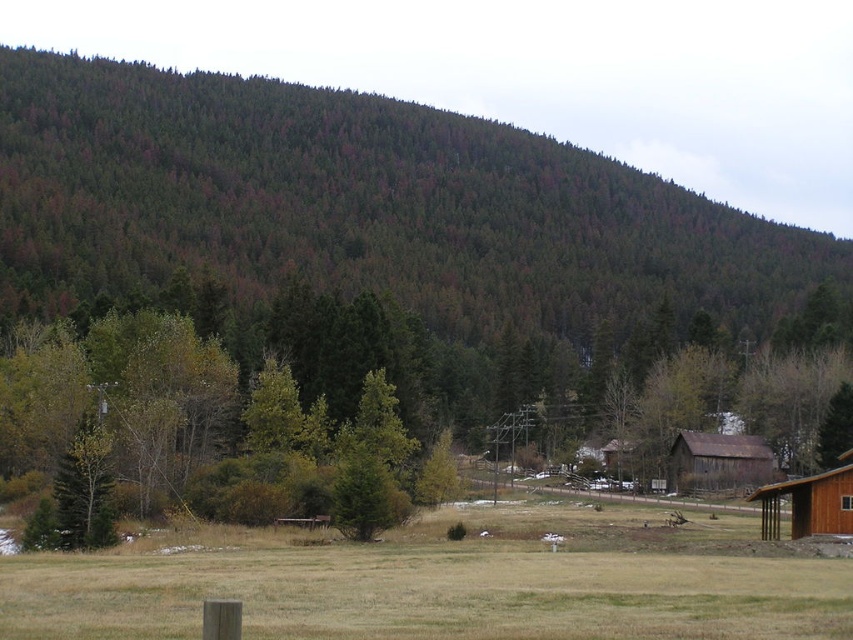
Question: Can you confirm if green forested hillside at upper center is positioned to the left of rustic wood barn at center-right?

Choices:
 (A) yes
 (B) no

Answer: (A)

Question: Which of the following is the farthest from the observer?

Choices:
 (A) brown wooden barn at lower right
 (B) green forested hillside at upper center
 (C) rustic wood barn at center-right

Answer: (B)

Question: Is green forested hillside at upper center to the right of brown wooden barn at lower right from the viewer's perspective?

Choices:
 (A) no
 (B) yes

Answer: (B)

Question: Does green forested hillside at upper center have a lesser width compared to rustic wood barn at center-right?

Choices:
 (A) yes
 (B) no

Answer: (B)

Question: Which object is closer to the camera taking this photo?

Choices:
 (A) brown wooden barn at lower right
 (B) rustic wood barn at center-right

Answer: (A)

Question: Which point appears farthest from the camera in this image?

Choices:
 (A) (833, 529)
 (B) (735, 449)

Answer: (B)